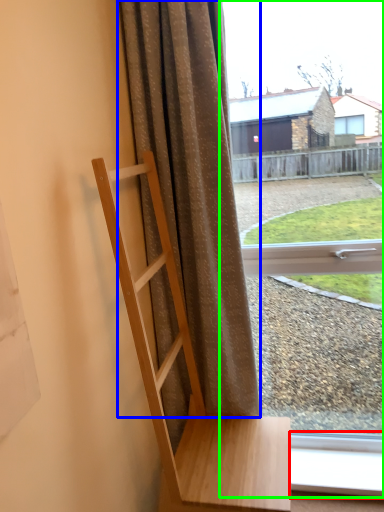
Question: Which is nearer to the window frame (highlighted by a red box)? curtain (highlighted by a blue box) or window (highlighted by a green box).

Choices:
 (A) curtain
 (B) window

Answer: (A)